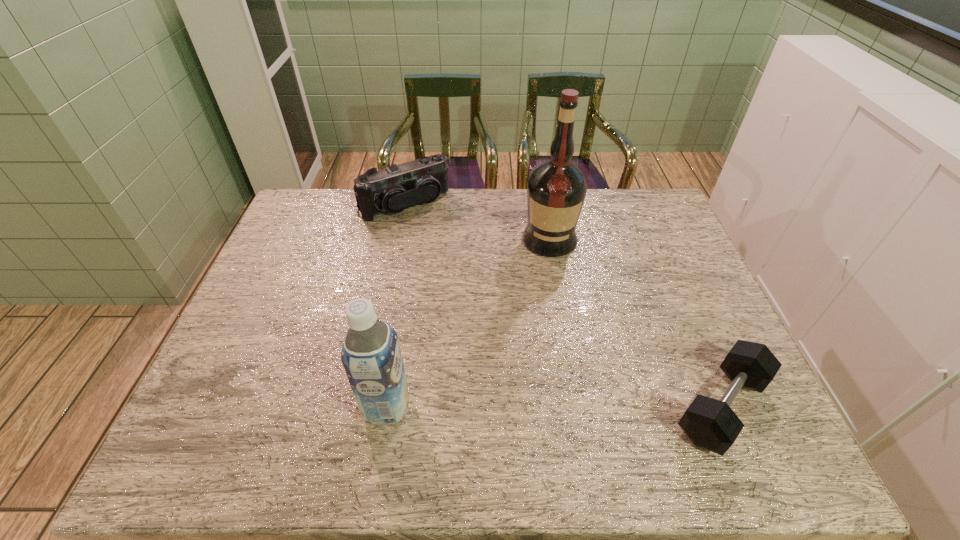
The width and height of the screenshot is (960, 540). Identify the location of object at the right edge. (711, 424).

Where is `object that is at the near right corner`? This screenshot has width=960, height=540. object that is at the near right corner is located at coordinates tap(711, 424).

Where is `free region at the far edge of the desktop`? free region at the far edge of the desktop is located at coordinates (398, 230).

In the image, there is a desktop. At what (x,y) coordinates should I click in order to perform the action: click on free space at the near edge. Please return your answer as a coordinate pair (x, y). Image resolution: width=960 pixels, height=540 pixels. Looking at the image, I should click on (342, 387).

In the image, there is a desktop. Identify the location of vacant space at the left edge. This screenshot has width=960, height=540. (321, 243).

Image resolution: width=960 pixels, height=540 pixels. Find the location of `free space at the right edge of the desktop`. free space at the right edge of the desktop is located at coordinates (680, 290).

In the image, there is a desktop. Find the location of `blank space at the far left corner`. blank space at the far left corner is located at coordinates (312, 226).

At what (x,y) coordinates should I click in order to perform the action: click on free region at the far right corner. Please return your answer as a coordinate pair (x, y). Looking at the image, I should click on (653, 213).

Find the location of a particular element. Image resolution: width=960 pixels, height=540 pixels. vacant region between the second shortest object and the soya milk is located at coordinates (396, 306).

You are a GUI agent. You are given a task and a screenshot of the screen. Output one action in this format:
    pyautogui.click(x=<x>, y=<y>)
    Task: Click on the unoccupied position between the soya milk and the rightmost object
    The image size is (960, 540).
    Given the screenshot: What is the action you would take?
    pyautogui.click(x=554, y=407)